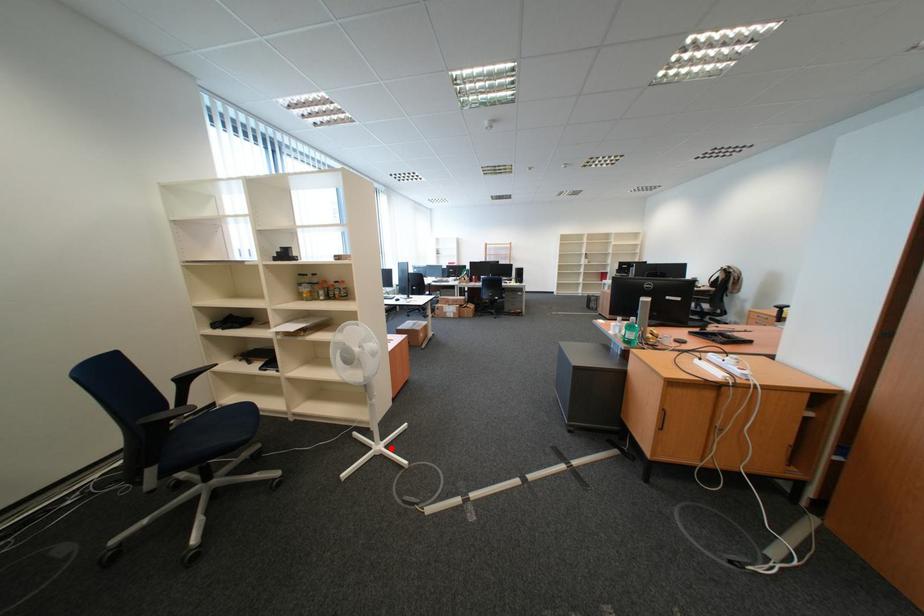
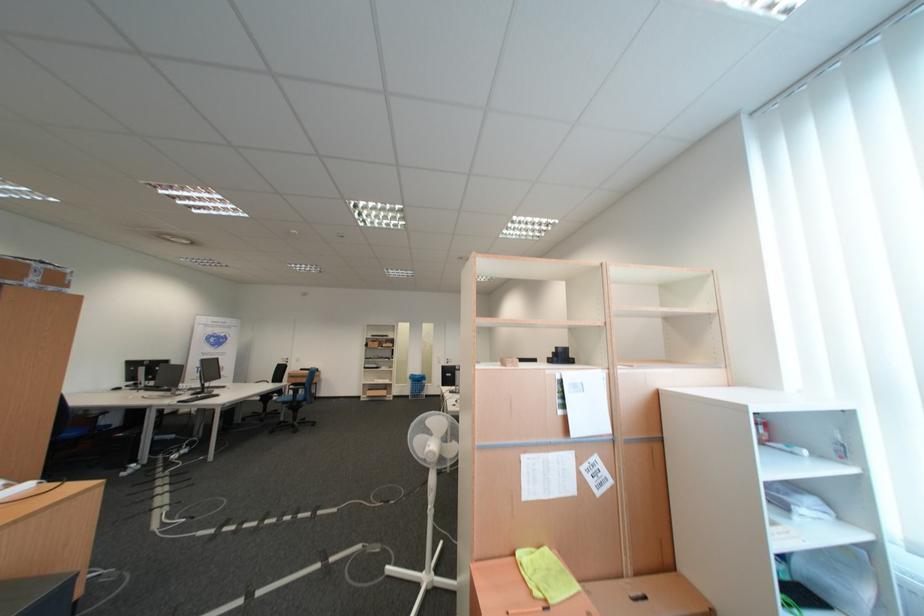
Question: I am providing you with two images of the same scene from different viewpoints. Given a red point in image1, look at the same physical point in image2. Is it:

Choices:
 (A) Closer to the viewpoint
 (B) Farther from the viewpoint

Answer: (B)